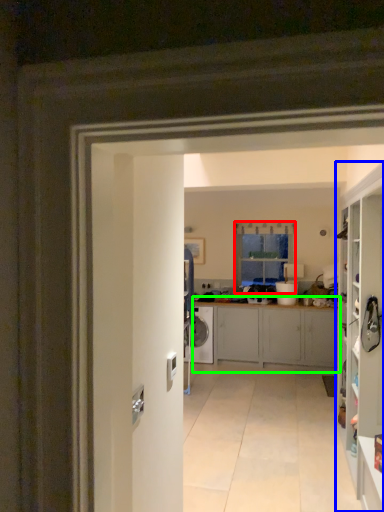
Question: Estimate the real-world distances between objects in this image. Which object is closer to window (highlighted by a red box), cabinetry (highlighted by a blue box) or cabinetry (highlighted by a green box)?

Choices:
 (A) cabinetry
 (B) cabinetry

Answer: (B)